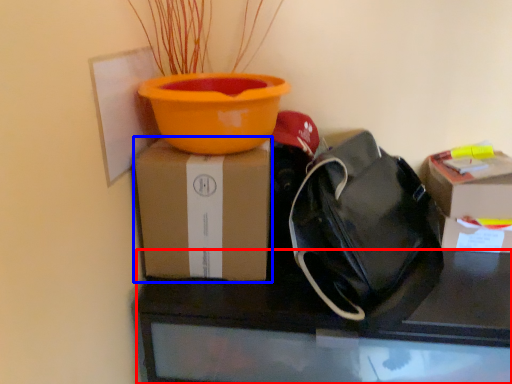
Question: Among these objects, which one is farthest to the camera, desk (highlighted by a red box) or box (highlighted by a blue box)?

Choices:
 (A) desk
 (B) box

Answer: (B)